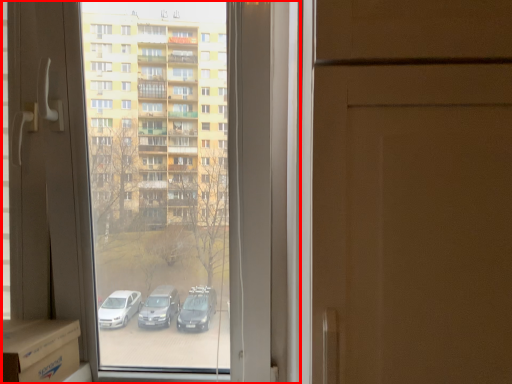
Question: From the image's perspective, where is window (annotated by the red box) located relative to cardboard box?

Choices:
 (A) below
 (B) above

Answer: (B)